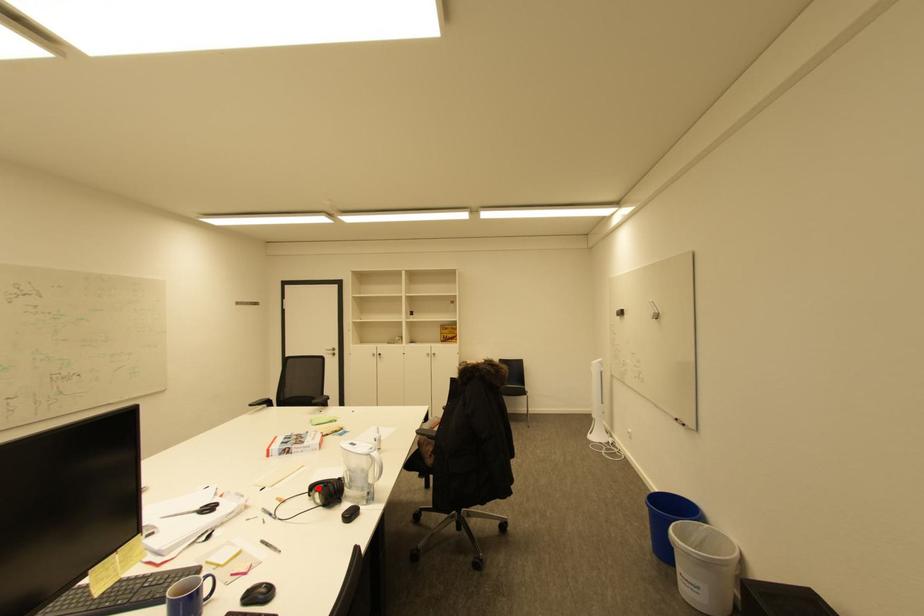
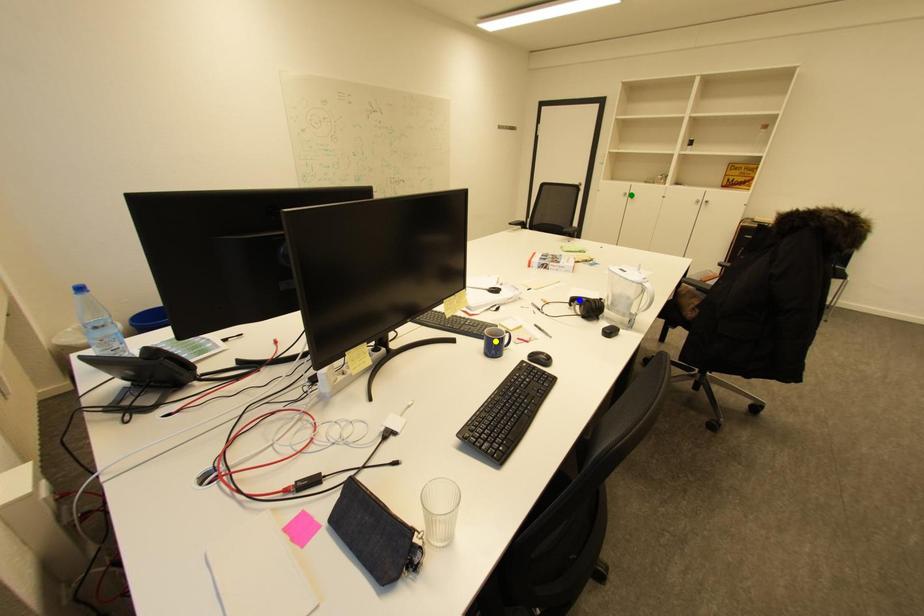
Question: I am providing you with two images of the same scene from different viewpoints. A red point is marked on the first image. You are given multiple points on the second image. Which point in image 2 is actually the same real-world point as the red point in image 1?

Choices:
 (A) green point
 (B) yellow point
 (C) blue point

Answer: (C)